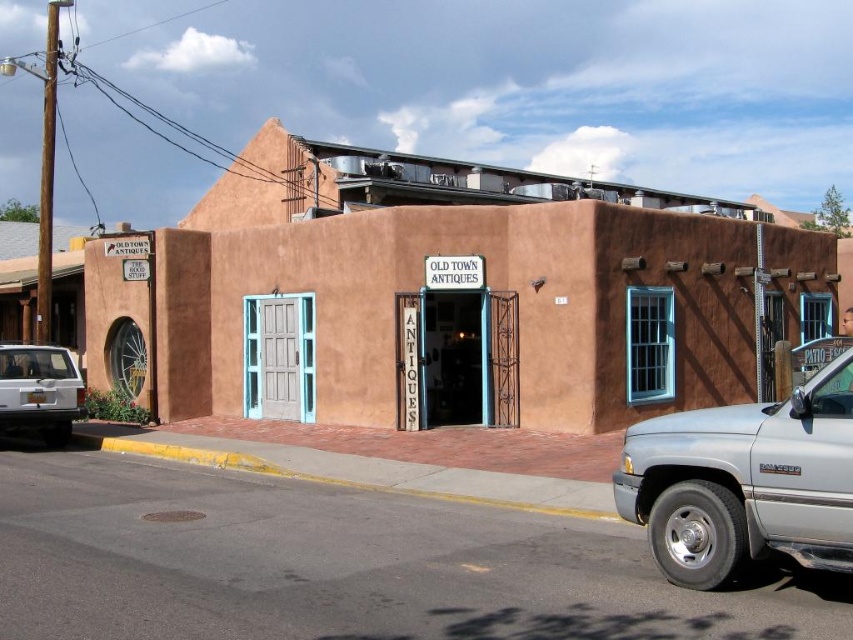
Is point (677, 572) closer to viewer compared to point (33, 346)?

Yes, point (677, 572) is closer to viewer.

Identify the location of silver metallic truck at right. (744, 483).

Which is in front, point (654, 477) or point (33, 394)?

Point (654, 477)

This screenshot has height=640, width=853. In order to click on silver metallic truck at right in this screenshot , I will do `click(744, 483)`.